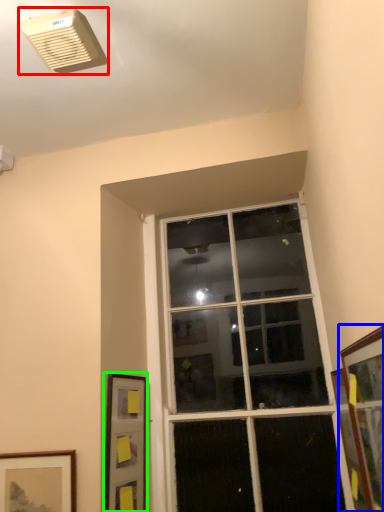
Question: Which object is positioned closest to air conditioning (highlighted by a red box)? Select from picture frame (highlighted by a blue box) and picture frame (highlighted by a green box).

Choices:
 (A) picture frame
 (B) picture frame

Answer: (A)